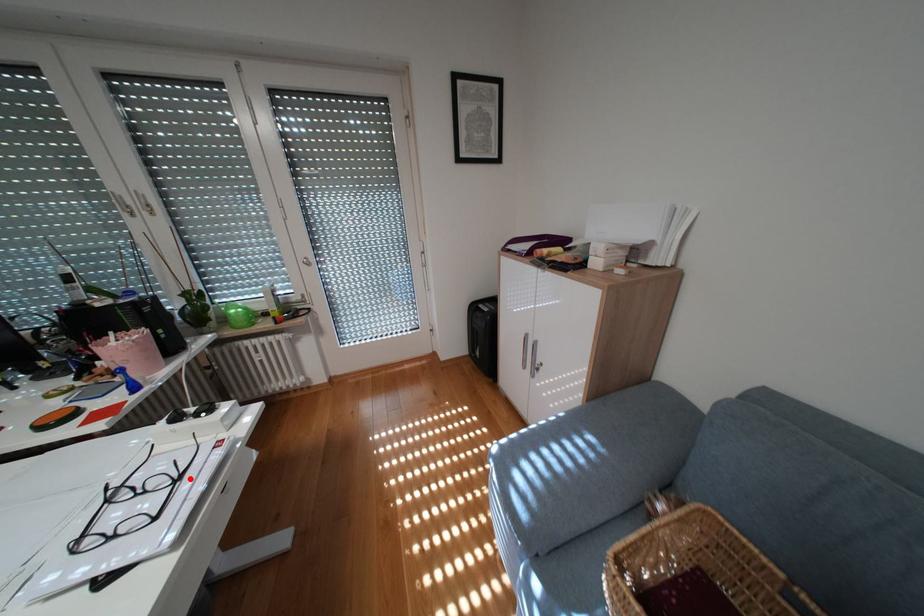
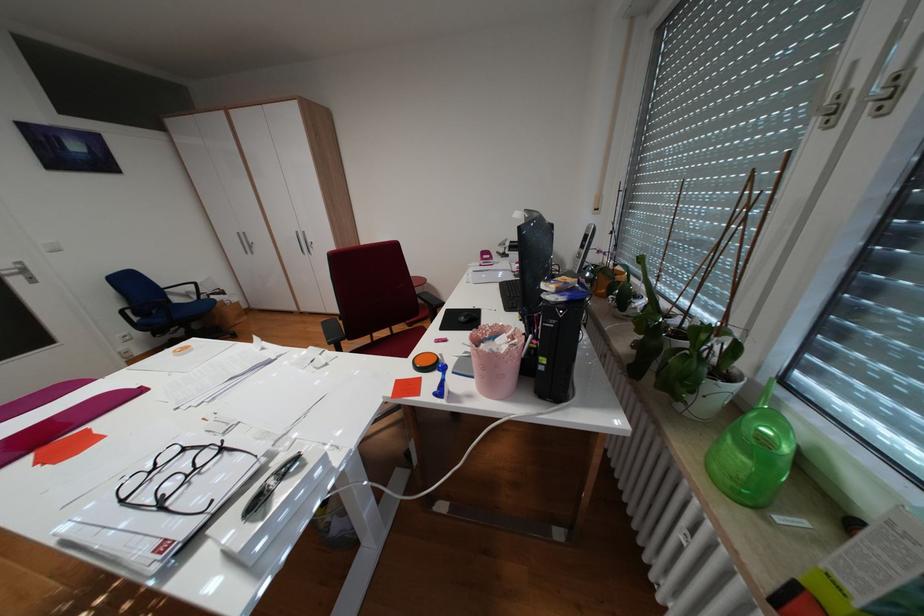
Find the pixel in the second image that matches the highlighted location in the first image.

(173, 505)